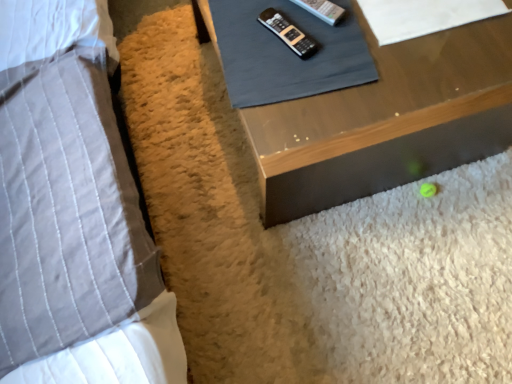
Question: Is the surface of gray quilted pillow at left in direct contact with wooden table at lower right?

Choices:
 (A) yes
 (B) no

Answer: (B)

Question: Is gray quilted pillow at left aimed at wooden table at lower right?

Choices:
 (A) yes
 (B) no

Answer: (A)

Question: Considering the relative sizes of gray quilted pillow at left and wooden table at lower right in the image provided, is gray quilted pillow at left bigger than wooden table at lower right?

Choices:
 (A) no
 (B) yes

Answer: (B)

Question: Considering the relative positions of gray quilted pillow at left and wooden table at lower right in the image provided, is gray quilted pillow at left behind wooden table at lower right?

Choices:
 (A) yes
 (B) no

Answer: (B)

Question: Can you confirm if gray quilted pillow at left is smaller than wooden table at lower right?

Choices:
 (A) yes
 (B) no

Answer: (B)

Question: From the image's perspective, would you say gray quilted pillow at left is shown under wooden table at lower right?

Choices:
 (A) no
 (B) yes

Answer: (B)

Question: Are wooden table at lower right and white paper at upper right, which is counted as the 1th sheet, starting from the right, making contact?

Choices:
 (A) yes
 (B) no

Answer: (B)

Question: Is wooden table at lower right further to camera compared to white paper at upper right, which is counted as the 1th sheet, starting from the right?

Choices:
 (A) yes
 (B) no

Answer: (B)

Question: Is wooden table at lower right in front of white paper at upper right, which is counted as the 1th sheet, starting from the right?

Choices:
 (A) no
 (B) yes

Answer: (B)

Question: From a real-world perspective, does wooden table at lower right stand above white paper at upper right, which is counted as the 1th sheet, starting from the right?

Choices:
 (A) yes
 (B) no

Answer: (B)

Question: From the image's perspective, does wooden table at lower right appear lower than white paper at upper right, which is counted as the 1th sheet, starting from the right?

Choices:
 (A) no
 (B) yes

Answer: (B)

Question: Can you confirm if wooden table at lower right is thinner than white paper at upper right, which is counted as the second sheet, starting from the left?

Choices:
 (A) no
 (B) yes

Answer: (A)

Question: From the image's perspective, would you say gray quilted pillow at left is shown under black plastic remote at upper center?

Choices:
 (A) yes
 (B) no

Answer: (A)